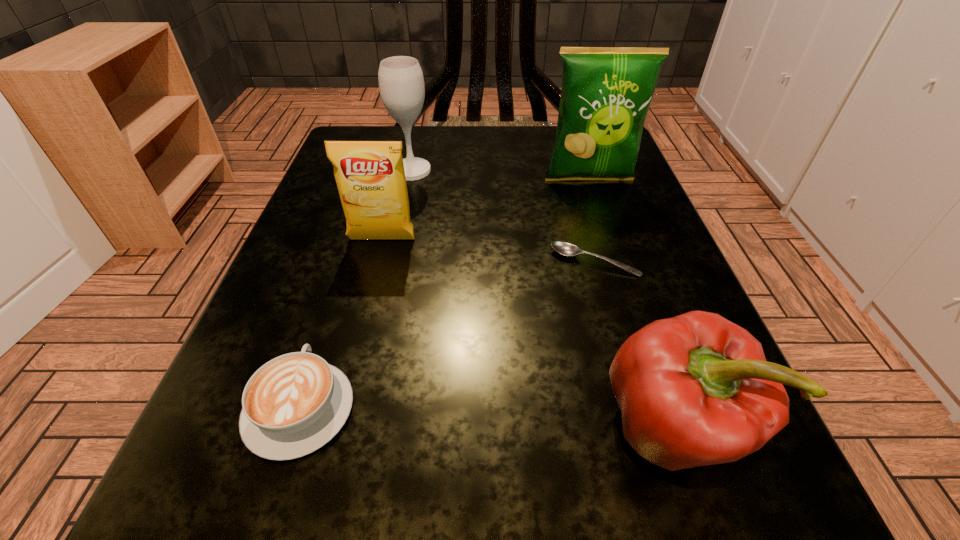
Where is `free space located 0.060m on the front of the left crisp (potato chip) with the logo`? free space located 0.060m on the front of the left crisp (potato chip) with the logo is located at coordinates (373, 274).

This screenshot has height=540, width=960. Identify the location of free location located on the left of the bell pepper. (349, 427).

At what (x,y) coordinates should I click in order to perform the action: click on vacant space situated on the side of the cappuccino with the handle. Please return your answer as a coordinate pair (x, y). The height and width of the screenshot is (540, 960). Looking at the image, I should click on (346, 265).

Where is `free region located 0.090m on the side of the cappuccino with the handle`? free region located 0.090m on the side of the cappuccino with the handle is located at coordinates (333, 305).

Locate an element on the screen. This screenshot has width=960, height=540. vacant region located 0.210m on the side of the cappuccino with the handle is located at coordinates (351, 247).

Where is `vacant space located on the back of the shortest object`? The width and height of the screenshot is (960, 540). vacant space located on the back of the shortest object is located at coordinates (582, 215).

Identify the location of crisp (potato chip) located in the far edge section of the desktop. (606, 92).

Where is `wineglass positioned at the far edge`? wineglass positioned at the far edge is located at coordinates (401, 83).

Find the location of a particular element. Image resolution: width=960 pixels, height=540 pixels. object that is at the near edge is located at coordinates (694, 390).

Where is `wineglass present at the left edge`? This screenshot has height=540, width=960. wineglass present at the left edge is located at coordinates (401, 83).